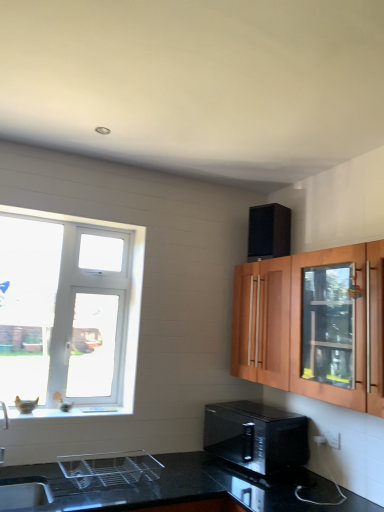
The image size is (384, 512). Describe the element at coordinates (69, 412) in the screenshot. I see `white glossy window sill at lower left` at that location.

Measure the distance between clear glass dish rack at lower center, arranged as the second appliance when viewed from the back, and camera.

The distance of clear glass dish rack at lower center, arranged as the second appliance when viewed from the back, from camera is 6.62 feet.

What do you see at coordinates (295, 324) in the screenshot? I see `wooden cabinet with glass door at upper right` at bounding box center [295, 324].

What are the coordinates of `white plastic window at left` in the screenshot? It's located at (70, 311).

At what (x,y) coordinates should I click in order to perform the action: click on white glossy window sill at lower left. Please return your answer as a coordinate pair (x, y). Image resolution: width=384 pixels, height=512 pixels. Looking at the image, I should click on (69, 412).

Can you tell me how much white plastic window at left and white glossy window sill at lower left differ in facing direction?

The facing directions of white plastic window at left and white glossy window sill at lower left are 0.419 degrees apart.

From the image's perspective, which one is positioned higher, white plastic window at left or white glossy window sill at lower left?

white plastic window at left.

Is white plastic window at left wider or thinner than white glossy window sill at lower left?

Considering their sizes, white plastic window at left looks slimmer than white glossy window sill at lower left.

Measure the distance between white plastic window at left and white glossy window sill at lower left.

white plastic window at left is 20.17 inches from white glossy window sill at lower left.

Consider the image. Is clear glass dish rack at lower center, which is the first appliance from front to back, placed right next to black glossy microwave at lower center?

clear glass dish rack at lower center, which is the first appliance from front to back, and black glossy microwave at lower center are clearly separated.

Which object is positioned more to the left, clear glass dish rack at lower center, which is the first appliance from front to back, or black glossy microwave at lower center?

Positioned to the left is clear glass dish rack at lower center, which is the first appliance from front to back.

Could you tell me if clear glass dish rack at lower center, which is the first appliance from front to back, is facing black glossy microwave at lower center?

No.

Is clear glass dish rack at lower center, which is the first appliance from front to back, spatially inside black glossy microwave at lower center, or outside of it?

The correct answer is: outside.

Between white glossy window sill at lower left and white plastic window at left, which one has less height?

Standing shorter between the two is white glossy window sill at lower left.

In terms of size, does white glossy window sill at lower left appear bigger or smaller than white plastic window at left?

Clearly, white glossy window sill at lower left is smaller in size than white plastic window at left.

From the image's perspective, is white glossy window sill at lower left positioned above or below white plastic window at left?

From the image's perspective, white glossy window sill at lower left appears below white plastic window at left.

Can you confirm if black textured speaker at upper right, which is counted as the second appliance, starting from the bottom, is positioned to the right of black glossy microwave at lower center?

Indeed, black textured speaker at upper right, which is counted as the second appliance, starting from the bottom, is positioned on the right side of black glossy microwave at lower center.

Consider the image. Is black textured speaker at upper right, the 1th appliance from the right, inside the boundaries of black glossy microwave at lower center, or outside?

black textured speaker at upper right, the 1th appliance from the right, lies outside black glossy microwave at lower center.

From the image's perspective, between black textured speaker at upper right, the 1th appliance viewed from the back, and black glossy microwave at lower center, which one is located above?

black textured speaker at upper right, the 1th appliance viewed from the back, from the image's perspective.

Considering the relative sizes of white plastic window at left and black textured speaker at upper right, the 1th appliance viewed from the back, in the image provided, is white plastic window at left shorter than black textured speaker at upper right, the 1th appliance viewed from the back,?

In fact, white plastic window at left may be taller than black textured speaker at upper right, the 1th appliance viewed from the back.

Is white plastic window at left not near black textured speaker at upper right, the 1th appliance from the right?

Yes, white plastic window at left and black textured speaker at upper right, the 1th appliance from the right, are quite far apart.

Considering the sizes of wooden cabinet with glass door at upper right and white glossy window sill at lower left in the image, is wooden cabinet with glass door at upper right taller or shorter than white glossy window sill at lower left?

Considering their sizes, wooden cabinet with glass door at upper right has more height than white glossy window sill at lower left.

This screenshot has width=384, height=512. In order to click on window sill behind the wooden cabinet with glass door at upper right in this screenshot , I will do `click(69, 412)`.

Is wooden cabinet with glass door at upper right oriented towards white glossy window sill at lower left?

Yes, wooden cabinet with glass door at upper right is facing white glossy window sill at lower left.

From a real-world perspective, is wooden cabinet with glass door at upper right beneath white glossy window sill at lower left?

No, from a real-world perspective, wooden cabinet with glass door at upper right is not beneath white glossy window sill at lower left.

This screenshot has height=512, width=384. I want to click on cabinetry on the right of clear glass dish rack at lower center, positioned as the second appliance in right-to-left order, so click(x=295, y=324).

Is clear glass dish rack at lower center, the 1th appliance ordered from the bottom, positioned far away from wooden cabinet with glass door at upper right?

clear glass dish rack at lower center, the 1th appliance ordered from the bottom, is far away from wooden cabinet with glass door at upper right.

From the image's perspective, is clear glass dish rack at lower center, which appears as the 2th appliance when viewed from the top, located above or below wooden cabinet with glass door at upper right?

Based on their image positions, clear glass dish rack at lower center, which appears as the 2th appliance when viewed from the top, is located beneath wooden cabinet with glass door at upper right.

Identify the location of window sill below the white plastic window at left (from the image's perspective). click(69, 412).

Locate an element on the screen. The width and height of the screenshot is (384, 512). microwave oven located above the clear glass dish rack at lower center, which appears as the 2th appliance when viewed from the top (from a real-world perspective) is located at coordinates (256, 436).

Considering their positions, is clear glass dish rack at lower center, arranged as the second appliance when viewed from the back, positioned further to white glossy window sill at lower left than wooden cabinet with glass door at upper right?

wooden cabinet with glass door at upper right.

Considering their positions, is black glossy microwave at lower center positioned closer to white plastic window at left than wooden cabinet with glass door at upper right?

The object closer to white plastic window at left is black glossy microwave at lower center.

When comparing their distances from wooden cabinet with glass door at upper right, does clear glass dish rack at lower center, which is the first appliance from front to back, or black glossy microwave at lower center seem closer?

Among the two, black glossy microwave at lower center is located nearer to wooden cabinet with glass door at upper right.

Looking at the image, which one is located further to black textured speaker at upper right, the 1th appliance from the right, white glossy window sill at lower left or wooden cabinet with glass door at upper right?

The object further to black textured speaker at upper right, the 1th appliance from the right, is white glossy window sill at lower left.

When comparing their distances from clear glass dish rack at lower center, the 1th appliance ordered from the bottom, does white plastic window at left or black glossy microwave at lower center seem closer?

Based on the image, black glossy microwave at lower center appears to be nearer to clear glass dish rack at lower center, the 1th appliance ordered from the bottom.

Which object lies nearer to the anchor point black textured speaker at upper right, the first appliance positioned from the top, black glossy microwave at lower center or wooden cabinet with glass door at upper right?

wooden cabinet with glass door at upper right.

From the image, which object appears to be farther from black glossy microwave at lower center, white glossy window sill at lower left or black textured speaker at upper right, which is counted as the second appliance, starting from the bottom?

black textured speaker at upper right, which is counted as the second appliance, starting from the bottom, is positioned further to the anchor black glossy microwave at lower center.

From the image, which object appears to be farther from black glossy microwave at lower center, black textured speaker at upper right, the 2th appliance positioned from the front, or wooden cabinet with glass door at upper right?

black textured speaker at upper right, the 2th appliance positioned from the front.

Image resolution: width=384 pixels, height=512 pixels. What are the coordinates of `window sill between white plastic window at left and wooden cabinet with glass door at upper right` in the screenshot? It's located at (69, 412).

This screenshot has width=384, height=512. What are the coordinates of `window sill between black textured speaker at upper right, the 1th appliance viewed from the back, and clear glass dish rack at lower center, the 1th appliance ordered from the bottom, from top to bottom` in the screenshot? It's located at (69, 412).

Image resolution: width=384 pixels, height=512 pixels. I want to click on microwave oven between clear glass dish rack at lower center, the 1th appliance ordered from the bottom, and wooden cabinet with glass door at upper right from left to right, so click(x=256, y=436).

Identify the location of microwave oven between white plastic window at left and black textured speaker at upper right, which is counted as the second appliance, starting from the bottom, in the horizontal direction. (256, 436).